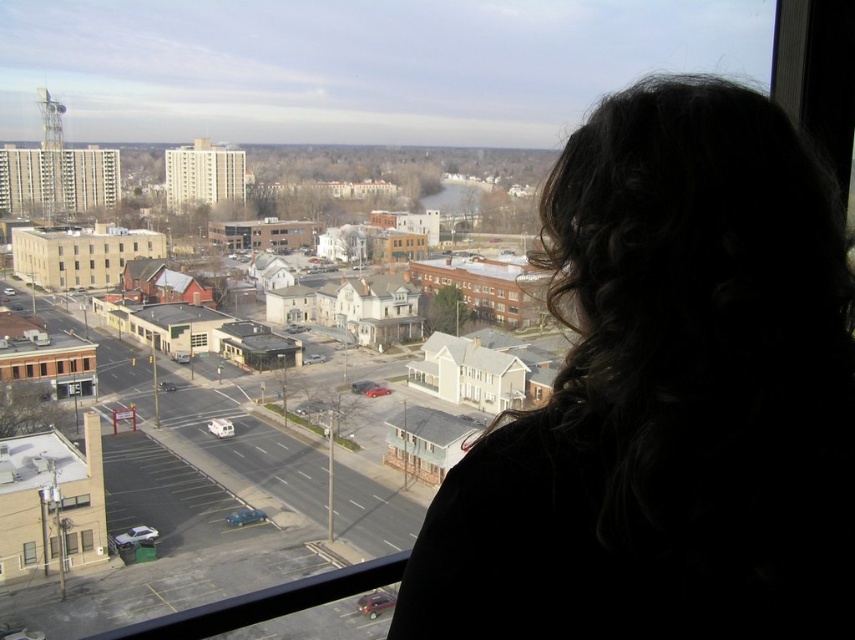
Which is above, dark curly hair at upper right or transparent glass window at lower left?

dark curly hair at upper right is above.

Consider the image. Between dark curly hair at upper right and transparent glass window at lower left, which one is positioned lower?

transparent glass window at lower left

At what (x,y) coordinates should I click in order to perform the action: click on dark curly hair at upper right. Please return your answer as a coordinate pair (x, y). This screenshot has height=640, width=855. Looking at the image, I should click on (667, 397).